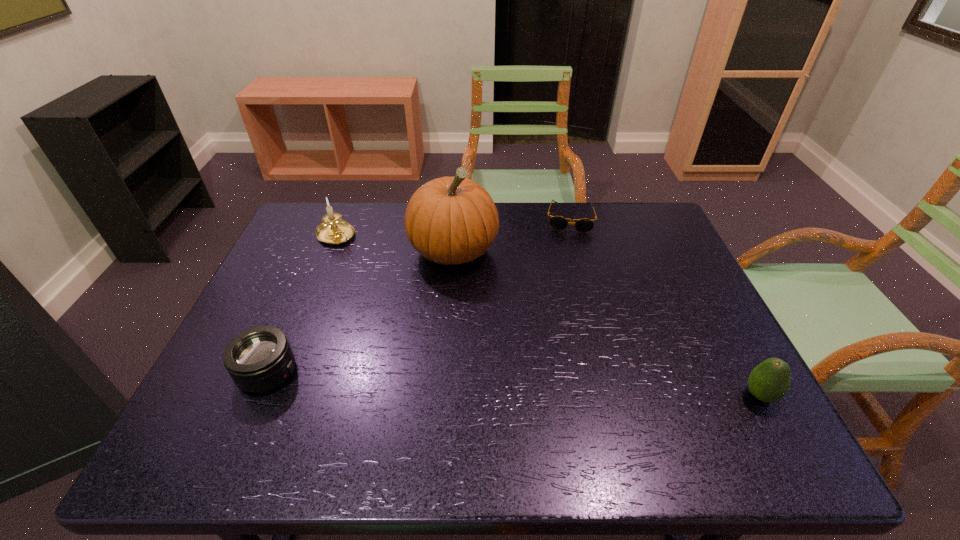
At what (x,y) coordinates should I click in order to perform the action: click on free region at the far edge of the desktop. Please return your answer as a coordinate pair (x, y). The height and width of the screenshot is (540, 960). Looking at the image, I should click on (359, 210).

Identify the location of vacant space at the near edge of the desktop. The width and height of the screenshot is (960, 540). (620, 404).

In the image, there is a desktop. Identify the location of vacant region at the left edge. (295, 287).

Image resolution: width=960 pixels, height=540 pixels. In order to click on free space at the right edge of the desktop in this screenshot , I will do `click(640, 284)`.

What are the coordinates of `vacant space at the far left corner` in the screenshot? It's located at (335, 245).

You are a GUI agent. You are given a task and a screenshot of the screen. Output one action in this format:
    pyautogui.click(x=<x>, y=<y>)
    Task: Click on the vacant space at the near left corner of the desktop
    This screenshot has width=960, height=540.
    Given the screenshot: What is the action you would take?
    pyautogui.click(x=222, y=380)

This screenshot has width=960, height=540. In order to click on vacant space at the far right corner of the desktop in this screenshot , I will do `click(628, 232)`.

I want to click on unoccupied area between the tallest object and the second tallest object, so click(395, 243).

Where is `vacant point located between the third shortest object and the shortest object`? The image size is (960, 540). vacant point located between the third shortest object and the shortest object is located at coordinates (664, 307).

The image size is (960, 540). Identify the location of vacant space in between the pumpkin and the third tallest object. (607, 323).